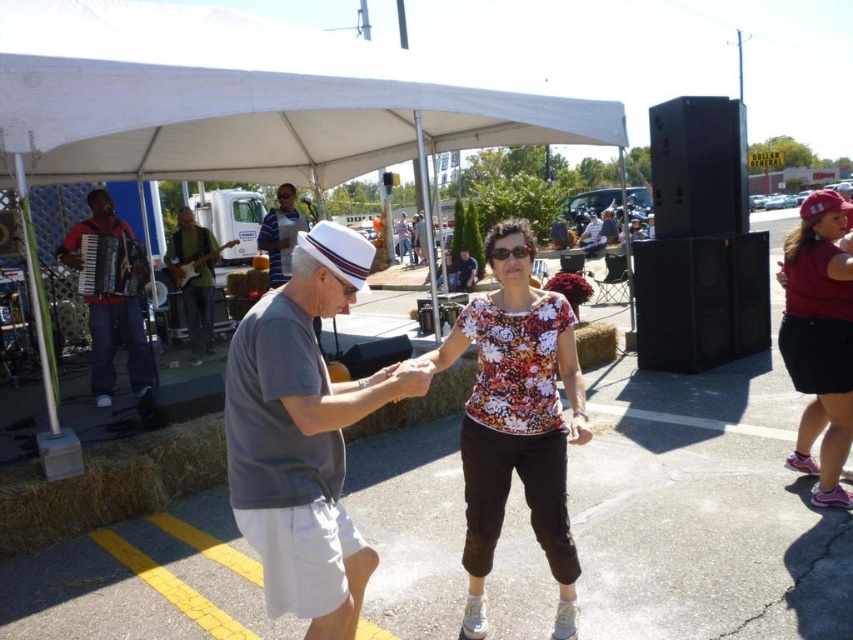
From the picture: You are a photographer at the event and want to capture a photo of both the floral fabric blouse at center and the matte black guitar at center without any obstructions. Which object should you move slightly backward to achieve this?

The floral fabric blouse at center is in front of the matte black guitar at center. To capture both without obstruction, move the floral fabric blouse at center backward so it is no longer blocking the matte black guitar at center.

You are a photographer at the event and want to ensure both the gray cotton shirt at center and the floral fabric blouse at center are clearly visible in your photo. Given their height difference, which one should you focus on first to ensure proper exposure?

The gray cotton shirt at center has a lesser height compared to the floral fabric blouse at center. To ensure proper exposure, focus on the floral fabric blouse at center first since it is taller and will require more attention in the frame.

You are at the outdoor event and want to locate the gray cotton shirt at center. According to the coordinates provided, where should you look to find it?

The gray cotton shirt at center is located at coordinates point (303, 435).